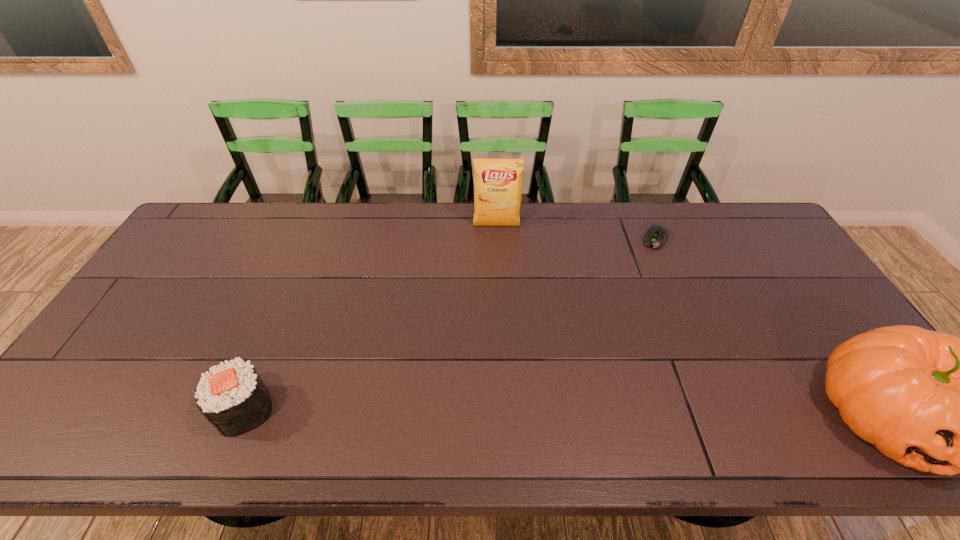
This screenshot has height=540, width=960. What are the coordinates of `free spot on the desktop that is between the sushi and the pumpkin and is positioned on the front of the crisp (potato chip) with the logo` in the screenshot? It's located at (501, 412).

You are a GUI agent. You are given a task and a screenshot of the screen. Output one action in this format:
    pyautogui.click(x=<x>, y=<y>)
    Task: Click on the vacant space on the desktop that is between the sushi and the rightmost object and is positioned on the wheel side of the computer mouse
    This screenshot has height=540, width=960.
    Given the screenshot: What is the action you would take?
    pyautogui.click(x=580, y=413)